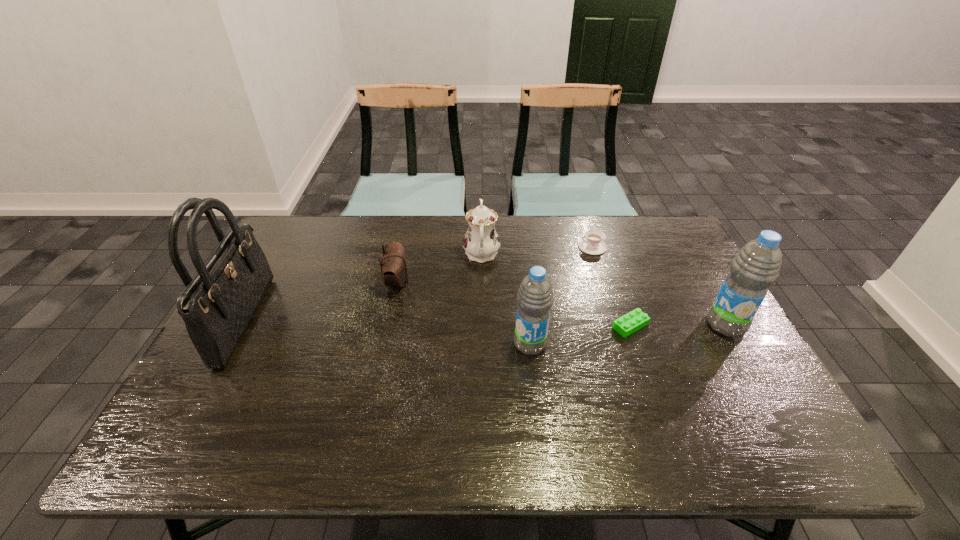
Where is `vacant space located 0.330m on the left of the Lego`? vacant space located 0.330m on the left of the Lego is located at coordinates (490, 326).

Where is `chinaware that is at the far edge`? chinaware that is at the far edge is located at coordinates (481, 242).

Locate an element on the screen. This screenshot has width=960, height=540. teacup that is at the far edge is located at coordinates (591, 243).

The image size is (960, 540). Find the location of `object at the left edge`. object at the left edge is located at coordinates (217, 305).

I want to click on object at the right edge, so click(756, 266).

At what (x,y) coordinates should I click in order to perform the action: click on vacant point at the far edge. Please return your answer as a coordinate pair (x, y). The height and width of the screenshot is (540, 960). Looking at the image, I should click on (372, 245).

You are a GUI agent. You are given a task and a screenshot of the screen. Output one action in this format:
    pyautogui.click(x=<x>, y=<y>)
    Task: Click on the vacant area at the near edge
    The width and height of the screenshot is (960, 540).
    Given the screenshot: What is the action you would take?
    pyautogui.click(x=616, y=401)

Where is `free space at the left edge`? This screenshot has height=540, width=960. free space at the left edge is located at coordinates (198, 381).

In the image, there is a desktop. Where is `vacant area at the right edge`? This screenshot has width=960, height=540. vacant area at the right edge is located at coordinates pyautogui.click(x=648, y=261).

This screenshot has width=960, height=540. Find the location of `free region at the far right corner of the desktop`. free region at the far right corner of the desktop is located at coordinates (x=674, y=237).